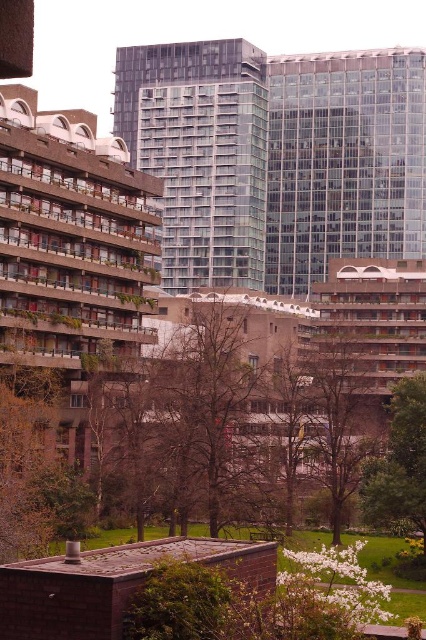
Is point (368, 97) farther from camera compared to point (414, 406)?

That is True.

Between glassy modern building at center and green leafy tree at lower right, which one has more height?

glassy modern building at center

Locate an element on the screen. glassy modern building at center is located at coordinates (276, 157).

Does glassy modern building at center have a lesser height compared to brown leafless tree at center?

In fact, glassy modern building at center may be taller than brown leafless tree at center.

Between point (143, 61) and point (359, 376), which one is positioned behind?

Point (143, 61)

Identify the location of glassy modern building at center. (276, 157).

Does brown leafless tree at center have a larger size compared to green leafy tree at lower right?

Yes, brown leafless tree at center is bigger than green leafy tree at lower right.

Looking at this image, is brown leafless tree at center positioned behind green leafy tree at lower right?

Yes, it is.

The image size is (426, 640). Describe the element at coordinates (339, 412) in the screenshot. I see `brown leafless tree at center` at that location.

The height and width of the screenshot is (640, 426). I want to click on brown leafless tree at center, so click(x=339, y=412).